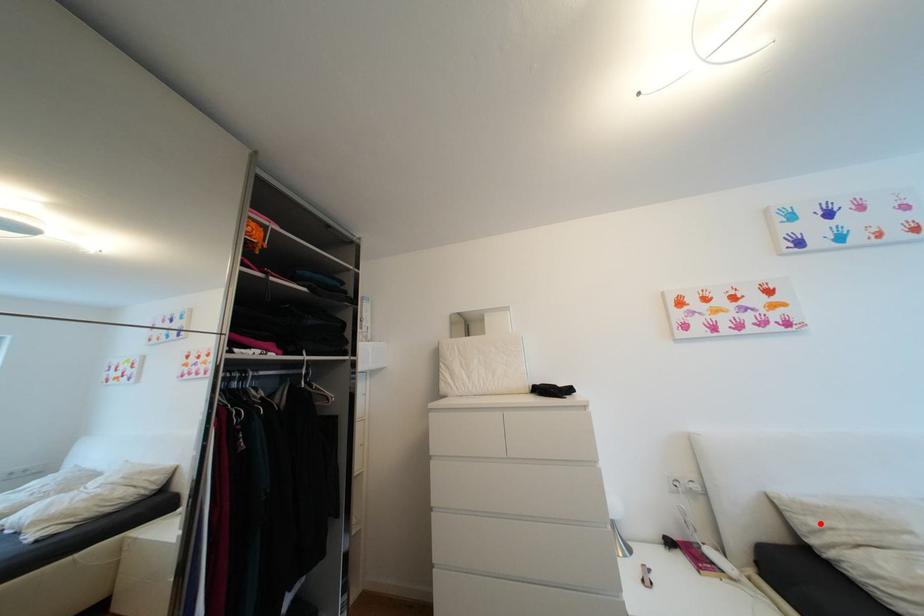
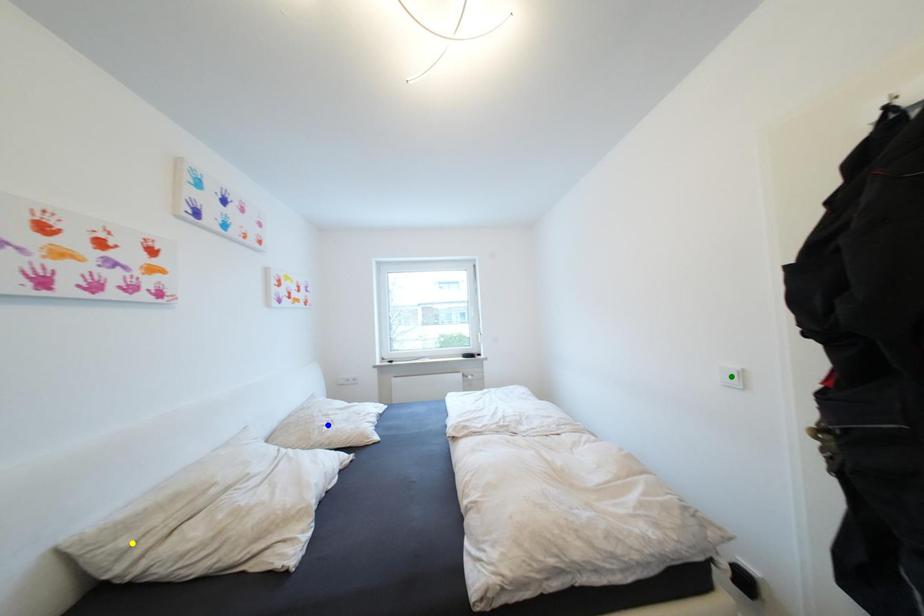
Question: I am providing you with two images of the same scene from different viewpoints. A red point is marked on the first image. You are given multiple points on the second image. Can you choose the point in image 2 that corresponds to the point in image 1?

Choices:
 (A) yellow point
 (B) blue point
 (C) green point

Answer: (A)